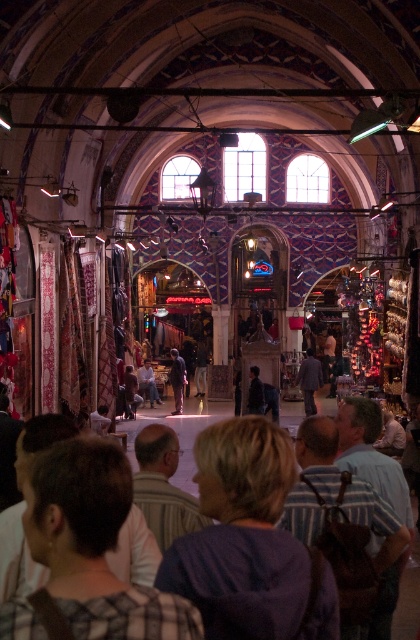
Is purple fabric at center to the left of plaid fabric shirt at lower center from the viewer's perspective?

In fact, purple fabric at center is to the right of plaid fabric shirt at lower center.

Is purple fabric at center below plaid fabric shirt at lower center?

Incorrect, purple fabric at center is not positioned below plaid fabric shirt at lower center.

Where is `purple fabric at center`? purple fabric at center is located at coordinates (241, 536).

Where is `purple fabric at center`? purple fabric at center is located at coordinates (241, 536).

Is plaid fabric shirt at lower center thinner than dark blue jeans at center?

In fact, plaid fabric shirt at lower center might be wider than dark blue jeans at center.

Is plaid fabric shirt at lower center bigger than dark blue jeans at center?

Correct, plaid fabric shirt at lower center is larger in size than dark blue jeans at center.

Locate an element on the screen. The height and width of the screenshot is (640, 420). plaid fabric shirt at lower center is located at coordinates (94, 545).

Does purple fabric at center have a smaller size compared to dark blue jeans at center?

No, purple fabric at center is not smaller than dark blue jeans at center.

Between point (307, 552) and point (126, 412), which one is positioned behind?

Point (126, 412)

Where is `purple fabric at center`? purple fabric at center is located at coordinates (241, 536).

You are a GUI agent. You are given a task and a screenshot of the screen. Output one action in this format:
    pyautogui.click(x=<x>, y=<y>)
    Task: Click on the purple fabric at center
    
    Given the screenshot: What is the action you would take?
    pyautogui.click(x=241, y=536)